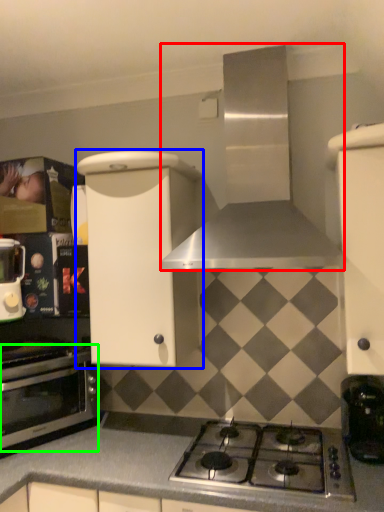
Question: Considering the real-world distances, which object is closest to home appliance (highlighted by a red box)? cabinetry (highlighted by a blue box) or oven (highlighted by a green box).

Choices:
 (A) cabinetry
 (B) oven

Answer: (A)